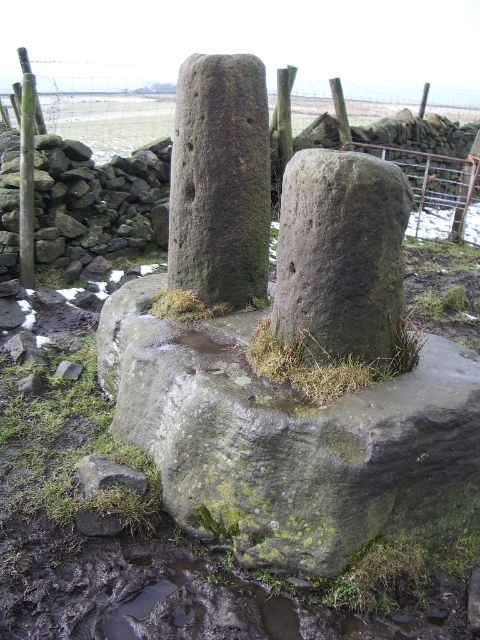
Question: Can you confirm if green mossy stone at center is positioned above green mossy rock at lower left?

Choices:
 (A) yes
 (B) no

Answer: (A)

Question: Which point is farther to the camera?

Choices:
 (A) green mossy rock at center
 (B) green mossy grass at center
 (C) smooth wooden post at left

Answer: (C)

Question: Is green mossy rock at center wider than green mossy stone at center?

Choices:
 (A) no
 (B) yes

Answer: (B)

Question: Based on their relative distances, which object is nearer to the green mossy stone at center?

Choices:
 (A) green mossy rock at lower left
 (B) green mossy rock at center
 (C) green mossy grass at center
 (D) smooth wooden post at left

Answer: (C)

Question: Which is farther from the green mossy rock at lower left?

Choices:
 (A) green mossy rock at center
 (B) green mossy grass at center
 (C) smooth wooden post at left

Answer: (C)

Question: Does green mossy rock at center appear on the right side of smooth wooden post at left?

Choices:
 (A) yes
 (B) no

Answer: (A)